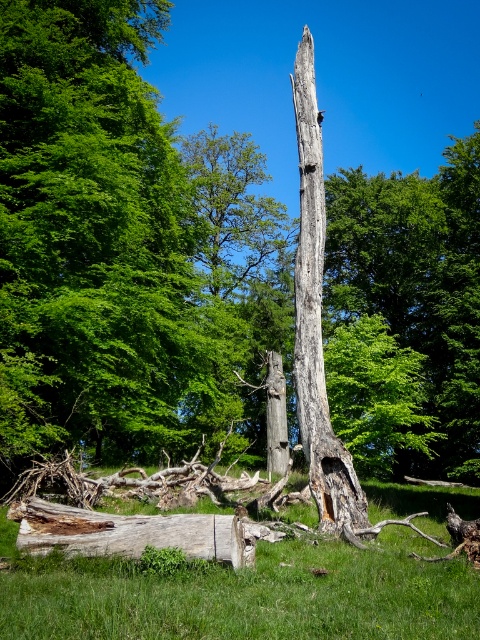
Question: In this image, where is dead wood trunk at center located relative to gray rough bark tree trunk at center?

Choices:
 (A) below
 (B) above

Answer: (A)

Question: Is dead wood trunk at center to the left of green grass at center from the viewer's perspective?

Choices:
 (A) yes
 (B) no

Answer: (A)

Question: Among these points, which one is farthest from the camera?

Choices:
 (A) (307, 195)
 (B) (50, 278)

Answer: (B)

Question: Which point is closer to the camera?

Choices:
 (A) (301, 344)
 (B) (72, 544)
 (C) (120, 420)
 (D) (342, 577)

Answer: (B)

Question: Is dead wood trunk at center in front of weathered wood log at lower left?

Choices:
 (A) no
 (B) yes

Answer: (A)

Question: Considering the real-world distances, which object is farthest from the dead wood trunk at center?

Choices:
 (A) weathered wood log at lower left
 (B) green grass at center

Answer: (A)